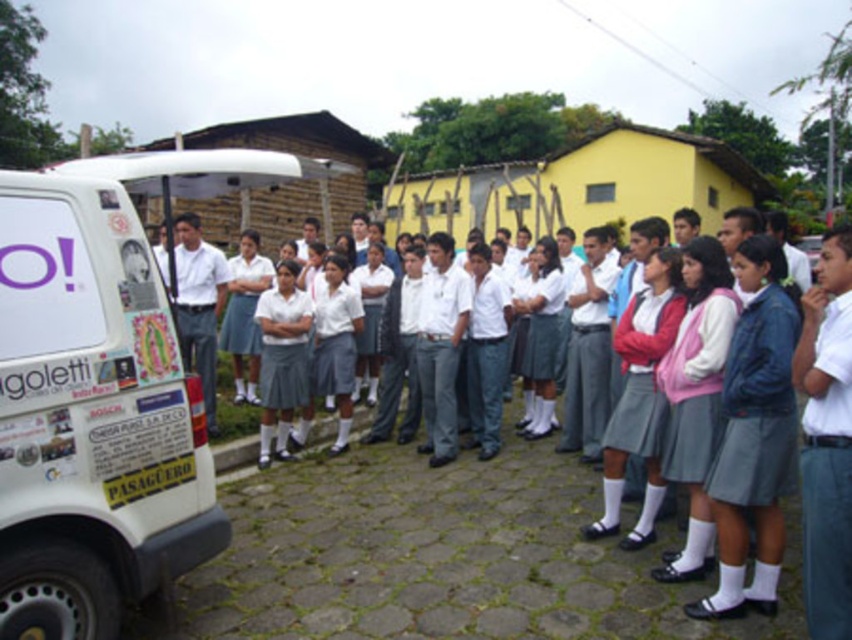
Question: Which point appears closest to the camera in this image?

Choices:
 (A) (269, 605)
 (B) (163, 456)

Answer: (B)

Question: Is white matte van at left closer to camera compared to white cotton shirt at center?

Choices:
 (A) no
 (B) yes

Answer: (B)

Question: Is white matte van at left above white cotton shirt at center?

Choices:
 (A) yes
 (B) no

Answer: (A)

Question: Which object appears closest to the camera in this image?

Choices:
 (A) white cotton shirt at center
 (B) white matte van at left

Answer: (B)

Question: Does white matte van at left have a lesser width compared to white cotton shirt at center?

Choices:
 (A) no
 (B) yes

Answer: (B)